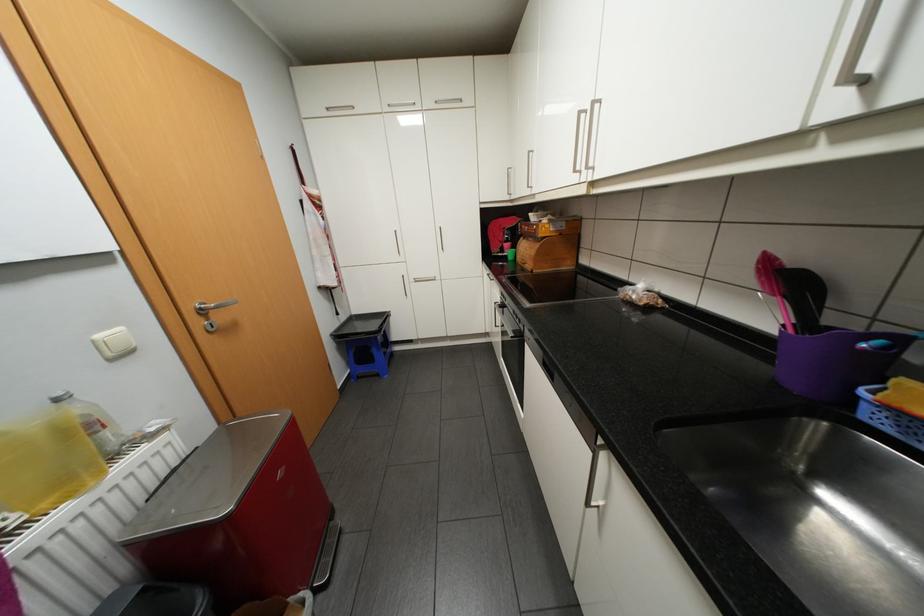
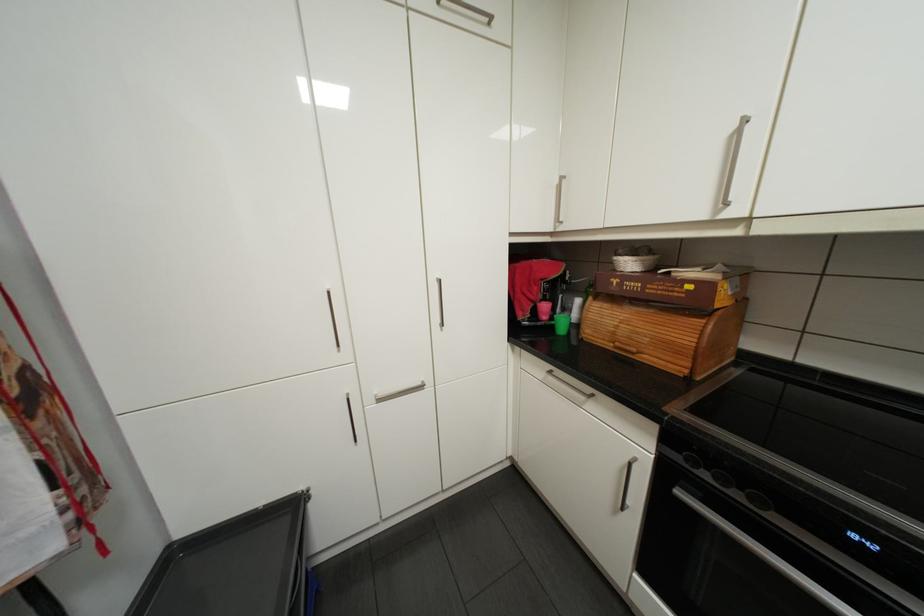
In the second image, find the point that corresponds to (x=548, y=233) in the first image.

(725, 305)